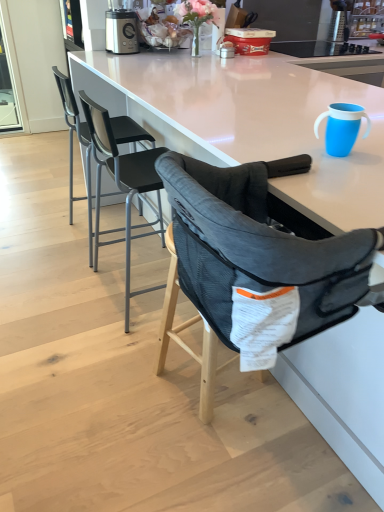
The width and height of the screenshot is (384, 512). I want to click on free spot to the left of mesh fabric high chair at center, so click(x=110, y=377).